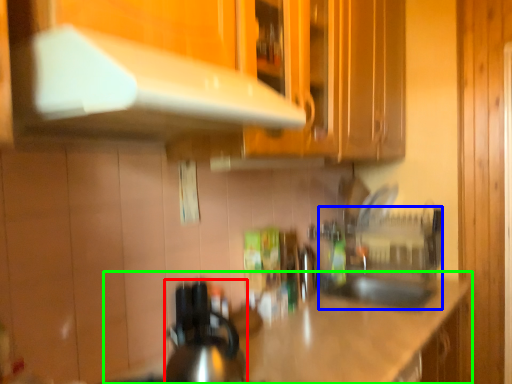
Question: Which is farther away from kitchen appliance (highlighted by a red box)? sink (highlighted by a blue box) or countertop (highlighted by a green box)?

Choices:
 (A) sink
 (B) countertop

Answer: (A)